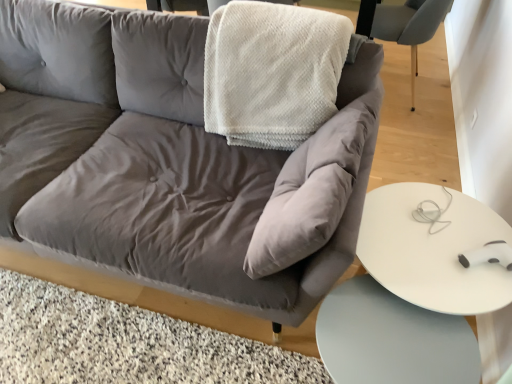
Question: From the image's perspective, is white textured blanket at upper center on matte gray chair at upper right?

Choices:
 (A) no
 (B) yes

Answer: (A)

Question: Is the surface of white textured blanket at upper center in direct contact with matte gray chair at upper right?

Choices:
 (A) no
 (B) yes

Answer: (A)

Question: Is matte gray chair at upper right at the back of white textured blanket at upper center?

Choices:
 (A) no
 (B) yes

Answer: (B)

Question: Considering the relative positions of white textured blanket at upper center and matte gray chair at upper right in the image provided, is white textured blanket at upper center to the left of matte gray chair at upper right from the viewer's perspective?

Choices:
 (A) no
 (B) yes

Answer: (B)

Question: Is white textured blanket at upper center positioned before matte gray chair at upper right?

Choices:
 (A) yes
 (B) no

Answer: (A)

Question: Is white textured blanket at upper center taller or shorter than white glossy table at lower right, marked as the first table in a top-to-bottom arrangement?

Choices:
 (A) short
 (B) tall

Answer: (B)

Question: Is white textured blanket at upper center to the left or to the right of white glossy table at lower right, the 2th table positioned from the bottom, in the image?

Choices:
 (A) left
 (B) right

Answer: (A)

Question: From a real-world perspective, relative to white glossy table at lower right, the 2th table positioned from the bottom, is white textured blanket at upper center vertically above or below?

Choices:
 (A) above
 (B) below

Answer: (A)

Question: Is white textured blanket at upper center situated inside white glossy table at lower right, the 2th table positioned from the bottom, or outside?

Choices:
 (A) inside
 (B) outside

Answer: (B)

Question: Considering their positions, is velvet gray couch at center located in front of or behind white glossy table at lower right, the second table in the top-to-bottom sequence?

Choices:
 (A) behind
 (B) front

Answer: (B)

Question: From the image's perspective, relative to white glossy table at lower right, marked as the 1th table in a bottom-to-top arrangement, is velvet gray couch at center above or below?

Choices:
 (A) above
 (B) below

Answer: (A)

Question: Is velvet gray couch at center taller or shorter than white glossy table at lower right, the second table in the top-to-bottom sequence?

Choices:
 (A) short
 (B) tall

Answer: (B)

Question: Visually, is velvet gray couch at center positioned to the left or to the right of white glossy table at lower right, marked as the 1th table in a bottom-to-top arrangement?

Choices:
 (A) left
 (B) right

Answer: (A)

Question: Considering the positions of white glossy table at lower right, marked as the first table in a top-to-bottom arrangement, and white textured blanket at upper center in the image, is white glossy table at lower right, marked as the first table in a top-to-bottom arrangement, wider or thinner than white textured blanket at upper center?

Choices:
 (A) thin
 (B) wide

Answer: (A)

Question: From the image's perspective, is white glossy table at lower right, the 2th table positioned from the bottom, above or below white textured blanket at upper center?

Choices:
 (A) below
 (B) above

Answer: (A)